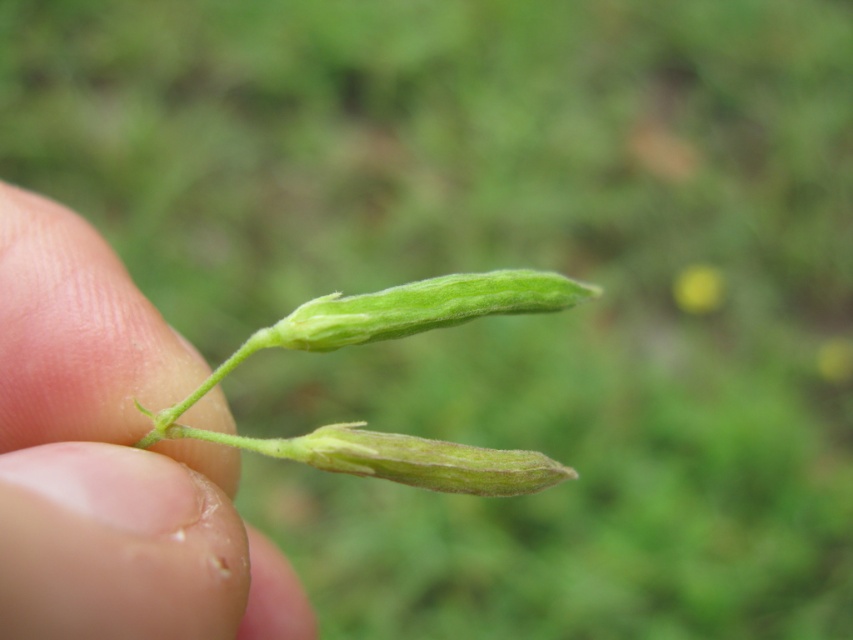
Is green matte pod at center to the right of green matte pod at upper center from the viewer's perspective?

Incorrect, green matte pod at center is not on the right side of green matte pod at upper center.

Between point (107, 346) and point (708, 291), which one is positioned behind?

The point (708, 291) is behind.

Does point (108, 349) come closer to viewer compared to point (722, 298)?

Yes, point (108, 349) is closer to viewer.

You are a GUI agent. You are given a task and a screenshot of the screen. Output one action in this format:
    pyautogui.click(x=<x>, y=<y>)
    Task: Click on the green matte pod at center
    The image size is (853, 640).
    Given the screenshot: What is the action you would take?
    pyautogui.click(x=112, y=460)